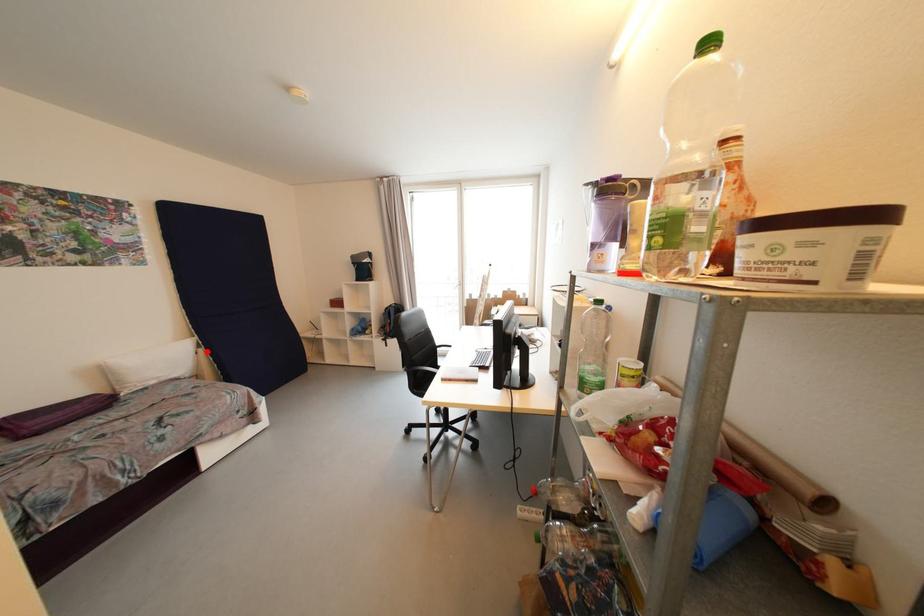
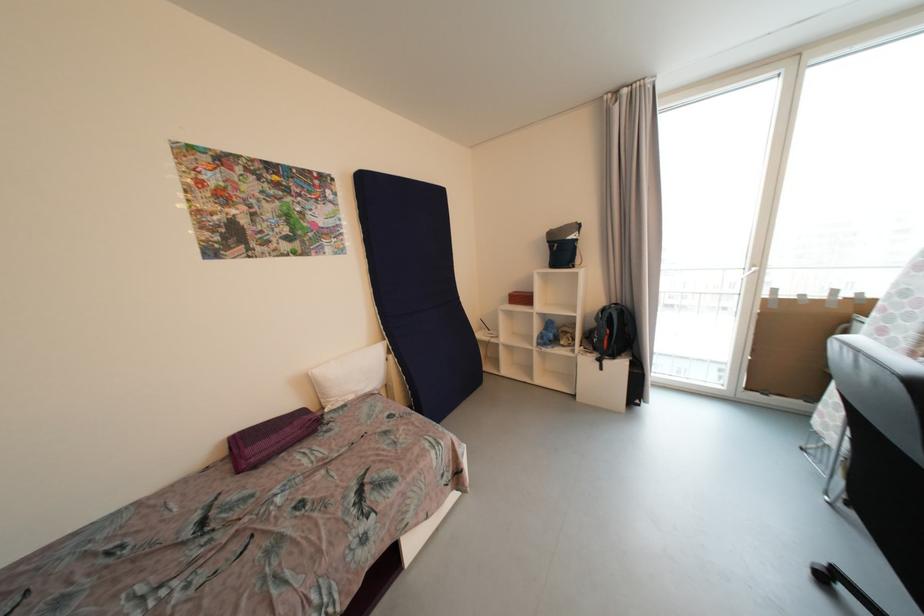
Find the pixel in the second image that matches the highlighted location in the first image.

(396, 359)